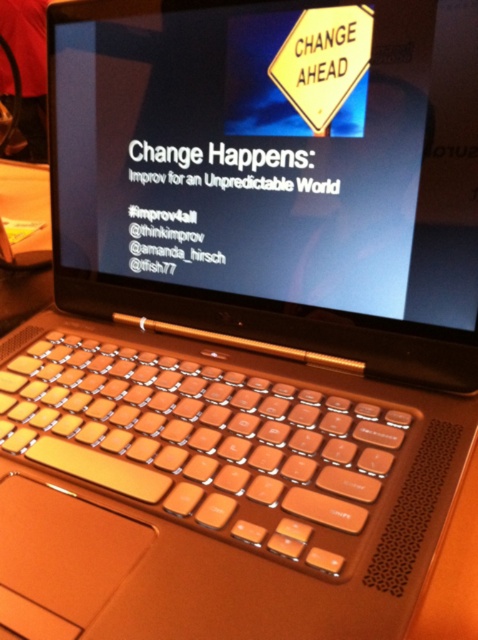
You are a graphic designer working on the laptop shown. You need to place two icons on the screen at the specified coordinates. The first icon must be placed at point (148, 177) and the second at point (141, 467). From the viewer perspective, which icon appears closer to you?

Point (141, 467) is closer to the viewer than point (148, 177) because the description states that point (148, 177) is behind point (141, 467).

You are holding a camera and want to take a photo of the matte black laptop at center. If your camera requires the subject to be at least 15 inches away to focus properly, will you need to move closer or farther away?

The matte black laptop at center is 14.59 inches from the camera, which is less than the required 15 inches. Therefore, you need to move farther away to ensure proper focus.

You are a graphic designer working on a project and need to place a new element on the laptop screen. The laptop is located at point (273, 152). Where should you position the new element to ensure it aligns with the laptop?

The new element should be positioned at point (273, 152) to align with the matte black laptop at center.